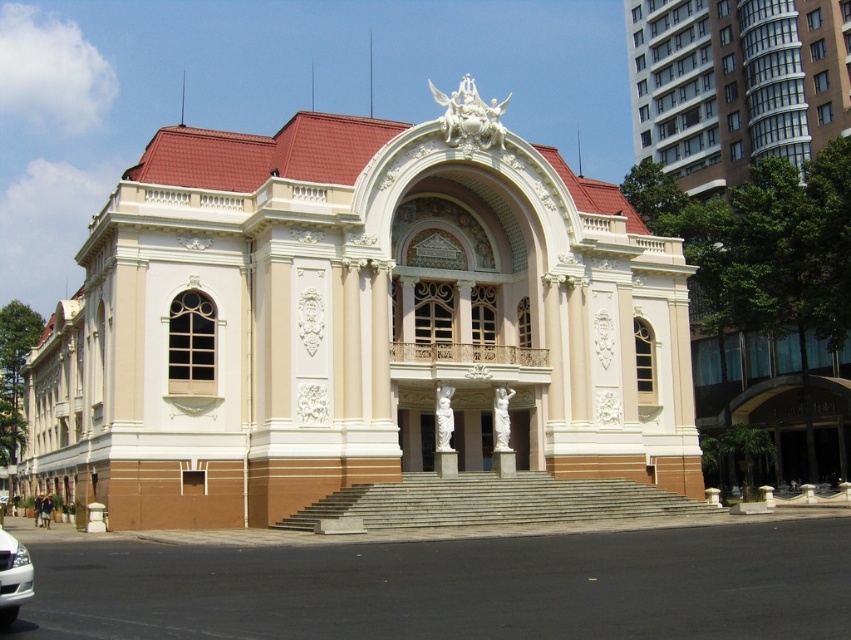
Between beige stone palace at center and white glossy car at lower left, which one is positioned lower?

white glossy car at lower left is below.

Does beige stone palace at center appear on the right side of white glossy car at lower left?

No, beige stone palace at center is not to the right of white glossy car at lower left.

The width and height of the screenshot is (851, 640). What do you see at coordinates (357, 323) in the screenshot?
I see `beige stone palace at center` at bounding box center [357, 323].

Find the location of `beige stone palace at center`. beige stone palace at center is located at coordinates (357, 323).